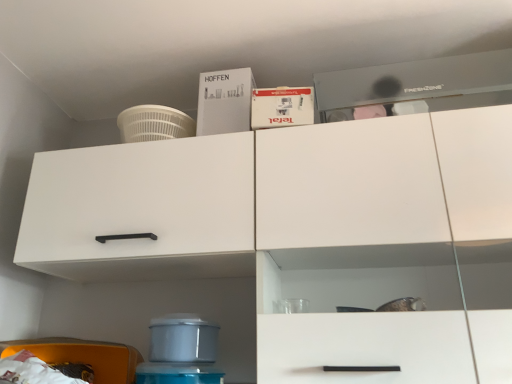
Image resolution: width=512 pixels, height=384 pixels. I want to click on white cardboard box at upper center, which ranks as the first box in front-to-back order, so click(x=282, y=107).

Is white matte cabinet at left far away from white cardboard box at upper center, which is the first box in right-to-left order?

white matte cabinet at left is actually quite close to white cardboard box at upper center, which is the first box in right-to-left order.

Considering the relative sizes of white matte cabinet at left and white cardboard box at upper center, which is the first box in right-to-left order, in the image provided, is white matte cabinet at left shorter than white cardboard box at upper center, which is the first box in right-to-left order,?

Incorrect, the height of white matte cabinet at left does not fall short of that of white cardboard box at upper center, which is the first box in right-to-left order.

Is point (243, 267) closer to camera compared to point (295, 105)?

That is False.

Between white cardboard box at upper center, placed as the second box when sorted from back to front, and white matte cabinet at left, which one has smaller width?

With smaller width is white cardboard box at upper center, placed as the second box when sorted from back to front.

Based on the photo, between white cardboard box at upper center, which ranks as the first box in front-to-back order, and white matte cabinet at left, which one has larger size?

white matte cabinet at left is bigger.

The width and height of the screenshot is (512, 384). Identify the location of cabinetry below the white cardboard box at upper center, which is the first box in right-to-left order (from a real-world perspective). (142, 210).

Between point (278, 116) and point (234, 181), which one is positioned in front?

Positioned in front is point (234, 181).

In the image, is white matte cabinet at left on the left side or the right side of white matte box at upper center, placed as the 2th box when sorted from front to back?

From the image, it's evident that white matte cabinet at left is to the left of white matte box at upper center, placed as the 2th box when sorted from front to back.

Locate an element on the screen. The width and height of the screenshot is (512, 384). the 1st box counting from the right of the white matte cabinet at left is located at coordinates (224, 101).

Is white matte cabinet at left a part of white matte box at upper center, which is the 1th box in left-to-right order?

No.

From the image's perspective, is white matte box at upper center, the 2th box positioned from the right, located above or below white matte cabinet at left?

Clearly, from the image's perspective, white matte box at upper center, the 2th box positioned from the right, is above white matte cabinet at left.

The height and width of the screenshot is (384, 512). Identify the location of cabinetry in front of the white matte box at upper center, the 1th box in the back-to-front sequence. (142, 210).

Is white matte box at upper center, the 1th box in the back-to-front sequence, positioned before white matte cabinet at left?

That is False.

In the image, is white cardboard box at upper center, the 2th box when ordered from left to right, positioned in front of or behind white matte box at upper center, which is the 1th box in left-to-right order?

In the image, white cardboard box at upper center, the 2th box when ordered from left to right, appears in front of white matte box at upper center, which is the 1th box in left-to-right order.

Is white matte box at upper center, which is the 1th box in left-to-right order, at the back of white cardboard box at upper center, the 2th box when ordered from left to right?

white cardboard box at upper center, the 2th box when ordered from left to right, does not have its back to white matte box at upper center, which is the 1th box in left-to-right order.

Considering the sizes of white cardboard box at upper center, placed as the second box when sorted from back to front, and white matte box at upper center, which is the 1th box in left-to-right order, in the image, is white cardboard box at upper center, placed as the second box when sorted from back to front, wider or thinner than white matte box at upper center, which is the 1th box in left-to-right order,?

In the image, white cardboard box at upper center, placed as the second box when sorted from back to front, appears to be wider than white matte box at upper center, which is the 1th box in left-to-right order.

Is point (283, 93) positioned behind point (217, 82)?

No, (283, 93) is in front of (217, 82).

Between white matte box at upper center, placed as the 2th box when sorted from front to back, and white cardboard box at upper center, placed as the second box when sorted from back to front, which one appears on the left side from the viewer's perspective?

white matte box at upper center, placed as the 2th box when sorted from front to back.

Consider the image. From a real-world perspective, is white matte box at upper center, the 2th box positioned from the right, positioned above or below white cardboard box at upper center, which is the first box in right-to-left order?

In terms of real-world spatial position, white matte box at upper center, the 2th box positioned from the right, is above white cardboard box at upper center, which is the first box in right-to-left order.

Is white cardboard box at upper center, which ranks as the first box in front-to-back order, at the back of white matte box at upper center, the 2th box positioned from the right?

That's not correct — white matte box at upper center, the 2th box positioned from the right, is not looking away from white cardboard box at upper center, which ranks as the first box in front-to-back order.

Locate an element on the screen. cabinetry on the left of white cardboard box at upper center, placed as the second box when sorted from back to front is located at coordinates (142, 210).

Starting from the white matte cabinet at left, which box is the 2nd one to the right? Please provide its 2D coordinates.

[(282, 107)]

Considering their positions, is white matte box at upper center, the 1th box in the back-to-front sequence, positioned further to white matte cabinet at left than white cardboard box at upper center, the 2th box when ordered from left to right?

The object further to white matte cabinet at left is white cardboard box at upper center, the 2th box when ordered from left to right.

Estimate the real-world distances between objects in this image. Which object is closer to white cardboard box at upper center, which is the first box in right-to-left order, white matte box at upper center, the 1th box in the back-to-front sequence, or white matte cabinet at left?

Based on the image, white matte box at upper center, the 1th box in the back-to-front sequence, appears to be nearer to white cardboard box at upper center, which is the first box in right-to-left order.

Which object lies further to the anchor point white matte box at upper center, the 2th box positioned from the right, white matte cabinet at left or white cardboard box at upper center, which ranks as the first box in front-to-back order?

white matte cabinet at left.

Looking at the image, which one is located further to white matte cabinet at left, white cardboard box at upper center, which ranks as the first box in front-to-back order, or white matte box at upper center, the 2th box positioned from the right?

white cardboard box at upper center, which ranks as the first box in front-to-back order, lies further to white matte cabinet at left than the other object.

Considering their positions, is white cardboard box at upper center, the 2th box when ordered from left to right, positioned closer to white matte box at upper center, which is the 1th box in left-to-right order, than white matte cabinet at left?

white cardboard box at upper center, the 2th box when ordered from left to right, is closer to white matte box at upper center, which is the 1th box in left-to-right order.

From the image, which object appears to be nearer to white cardboard box at upper center, which is the first box in right-to-left order, white matte cabinet at left or white matte box at upper center, the 1th box in the back-to-front sequence?

white matte box at upper center, the 1th box in the back-to-front sequence, lies closer to white cardboard box at upper center, which is the first box in right-to-left order, than the other object.

Identify the location of box between white matte cabinet at left and white cardboard box at upper center, which ranks as the first box in front-to-back order, from left to right. The width and height of the screenshot is (512, 384). (224, 101).